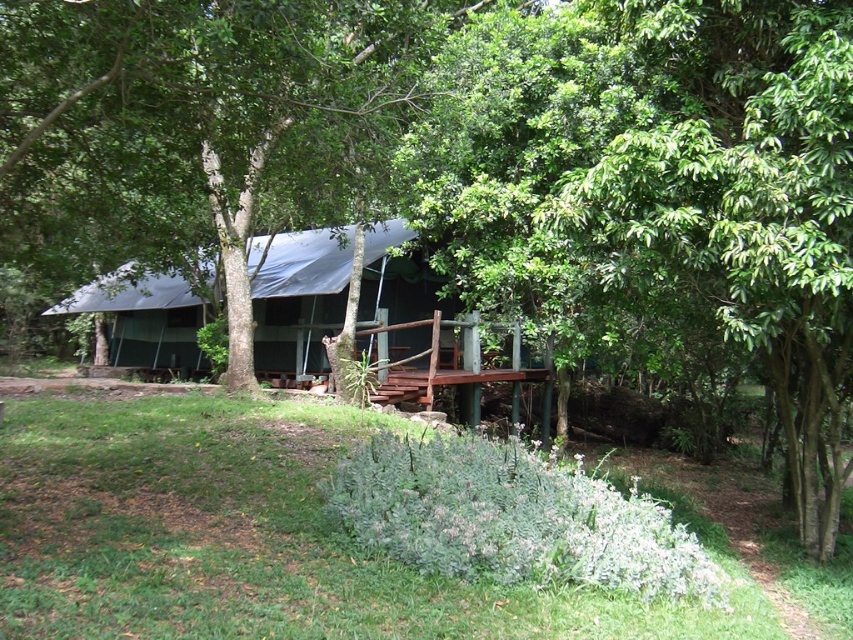
You are setting up a campsite and need to place a new fire pit. You have two options for locations near the white tarpaulin hut at center and the white tarpaulin canopy at center. Based on their positions, which location is to the left of the other?

The white tarpaulin canopy at center is to the left of the white tarpaulin hut at center because the hut is on the right side of the canopy.

You are planning to set up a campsite and need to choose between the white tarpaulin hut at center and the white tarpaulin canopy at center. Which one offers more space for your camping gear?

The white tarpaulin hut at center has a larger width than the white tarpaulin canopy at center, so it offers more space for camping gear.

You are planning to set up a tent in this campsite. You have two options for shelter materials available to you. The first is the white tarpaulin hut at center, and the second is the white tarpaulin canopy at center. Which of these shelters would provide more vertical space inside for standing upright?

The white tarpaulin hut at center has a greater height compared to the white tarpaulin canopy at center, so it would provide more vertical space inside for standing upright.